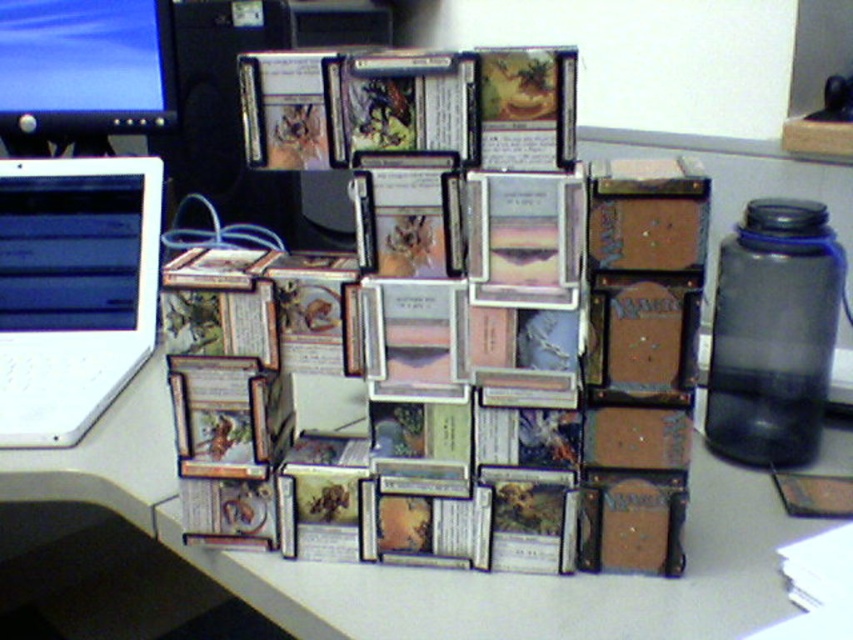
Question: Which of the following is the farthest from the observer?

Choices:
 (A) matte black monitor at upper left
 (B) matte black laptop at left
 (C) white plastic laptop at left

Answer: (A)

Question: Observing the image, what is the correct spatial positioning of smooth gray table at center in reference to matte black monitor at upper left?

Choices:
 (A) below
 (B) above

Answer: (A)

Question: Can you confirm if matte black monitor at upper left is thinner than matte black laptop at left?

Choices:
 (A) yes
 (B) no

Answer: (B)

Question: Which object is positioned farthest from the smooth gray table at center?

Choices:
 (A) white plastic laptop at left
 (B) matte black laptop at left
 (C) matte black monitor at upper left

Answer: (C)

Question: Which object is the closest to the smooth gray table at center?

Choices:
 (A) white plastic laptop at left
 (B) matte black monitor at upper left
 (C) matte black laptop at left

Answer: (A)

Question: Can you confirm if smooth gray table at center is positioned to the right of white plastic laptop at left?

Choices:
 (A) yes
 (B) no

Answer: (A)